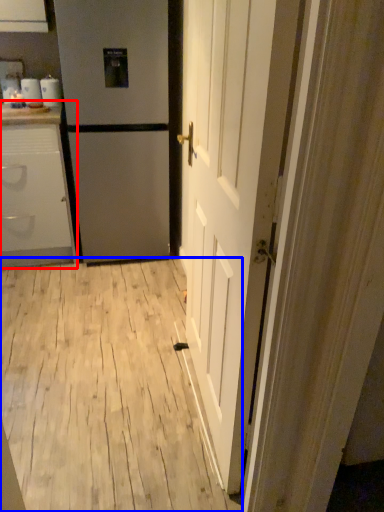
Question: Which point is closer to the camera, cabinetry (highlighted by a red box) or plywood (highlighted by a blue box)?

Choices:
 (A) cabinetry
 (B) plywood

Answer: (B)